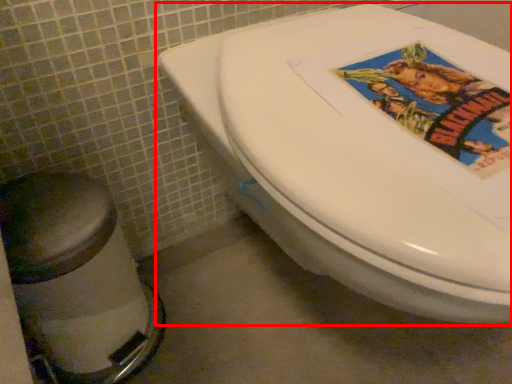
Question: Observing the image, what is the correct spatial positioning of toilet (annotated by the red box) in reference to bidet?

Choices:
 (A) left
 (B) right

Answer: (B)